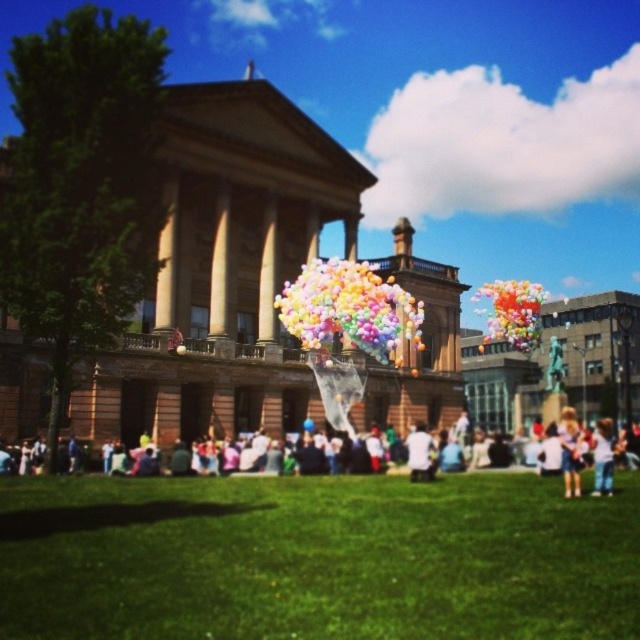
Question: Which object appears closest to the camera in this image?

Choices:
 (A) white cotton shirt at lower right
 (B) pastel balloons at upper center
 (C) pastel balloons at center
 (D) translucent plastic balloons at center

Answer: (A)

Question: Which point is farther to the camera?

Choices:
 (A) (413, 477)
 (B) (611, 449)

Answer: (A)

Question: Can you confirm if green grass at center is positioned to the right of translucent plastic balloons at center?

Choices:
 (A) no
 (B) yes

Answer: (B)

Question: In this image, where is white cotton shirt at lower right located relative to white cotton shirt at center?

Choices:
 (A) above
 (B) below

Answer: (B)

Question: Is green grass at center thinner than white cotton shirt at center?

Choices:
 (A) no
 (B) yes

Answer: (A)

Question: Which object is the farthest from the white cotton shirt at lower right?

Choices:
 (A) white cotton shirt at center
 (B) translucent plastic balloons at center

Answer: (B)